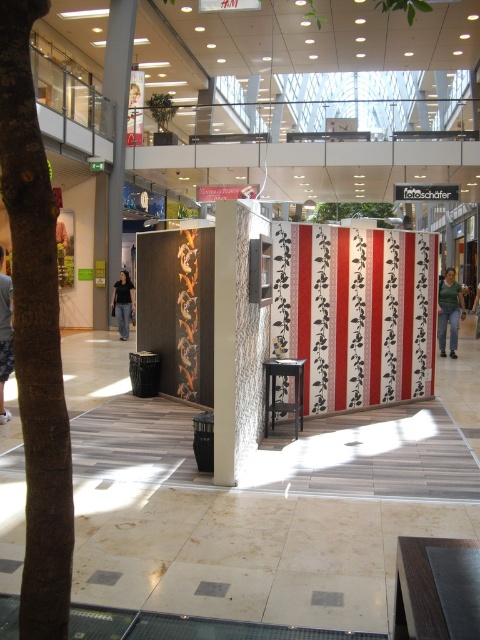
Between point (300, 365) and point (122, 301), which one is positioned behind?

The point (122, 301) is behind.

Does black glossy stool at center appear on the left side of black jeans at center?

Incorrect, black glossy stool at center is not on the left side of black jeans at center.

Who is more forward, (264, 390) or (116, 285)?

Positioned in front is point (264, 390).

In order to click on black glossy stool at center in this screenshot , I will do `click(275, 392)`.

Between black jeans at center and green fabric at center, which one has more height?

With more height is black jeans at center.

Which is below, black jeans at center or green fabric at center?

green fabric at center is lower down.

Does point (132, 304) come behind point (478, 333)?

Yes, it is behind point (478, 333).

The height and width of the screenshot is (640, 480). What are the coordinates of `black jeans at center` in the screenshot? It's located at (122, 304).

Can you confirm if brown rough bark tree at left is taller than light brown leather jacket at lower left?

Yes, brown rough bark tree at left is taller than light brown leather jacket at lower left.

Is brown rough bark tree at left above light brown leather jacket at lower left?

Yes.

The image size is (480, 640). I want to click on brown rough bark tree at left, so click(x=36, y=333).